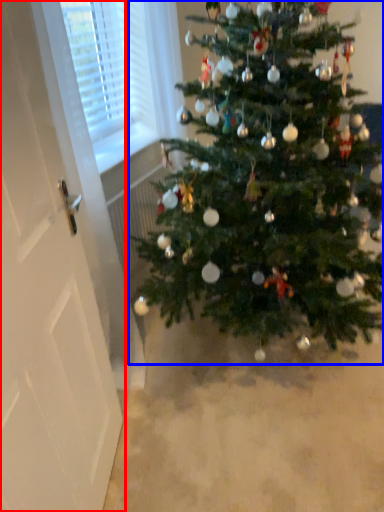
Question: Which object is further to the camera taking this photo, screen door (highlighted by a red box) or christmas tree (highlighted by a blue box)?

Choices:
 (A) screen door
 (B) christmas tree

Answer: (B)